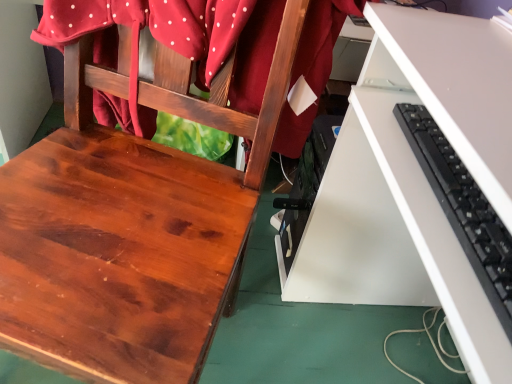
Question: Is white matte desk at lower right inside or outside of matte red fabric at upper left?

Choices:
 (A) inside
 (B) outside

Answer: (B)

Question: Relative to matte red fabric at upper left, is white matte desk at lower right in front or behind?

Choices:
 (A) front
 (B) behind

Answer: (A)

Question: Which object is the farthest from the black plastic keyboard at right?

Choices:
 (A) matte red fabric at upper left
 (B) white matte desk at lower right
 (C) shiny wood chair at center

Answer: (C)

Question: Which object is the farthest from the shiny wood chair at center?

Choices:
 (A) black plastic keyboard at right
 (B) white matte desk at lower right
 (C) matte red fabric at upper left

Answer: (A)